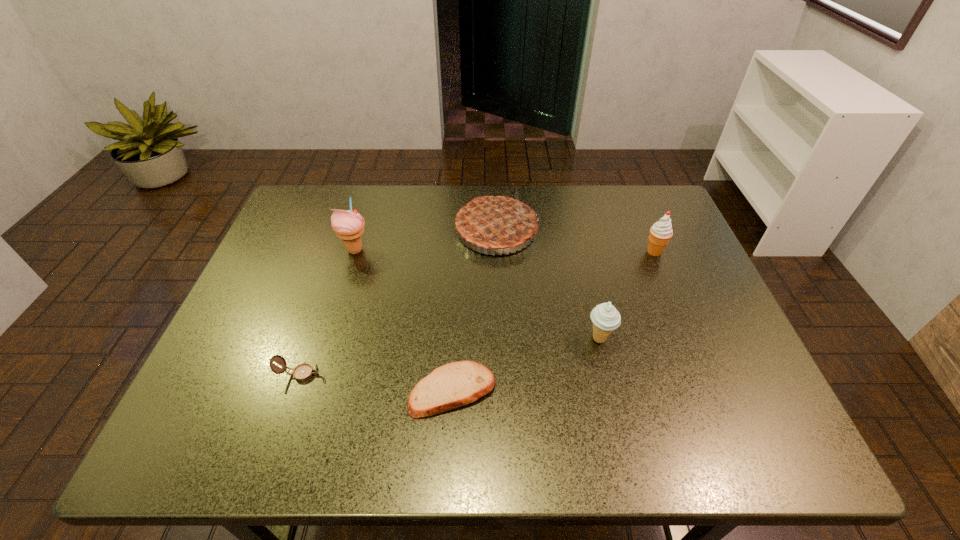
Identify the location of free location that satisfies the following two spatial constraints: 1. on the front side of the fourth farthest object; 2. on the face of the fifth tallest object. (608, 374).

Locate an element on the screen. free space that satisfies the following two spatial constraints: 1. on the front side of the rightmost object; 2. on the left side of the pie is located at coordinates (497, 252).

Locate an element on the screen. Image resolution: width=960 pixels, height=540 pixels. free spot that satisfies the following two spatial constraints: 1. on the back side of the pita bread; 2. on the right side of the rightmost object is located at coordinates (459, 252).